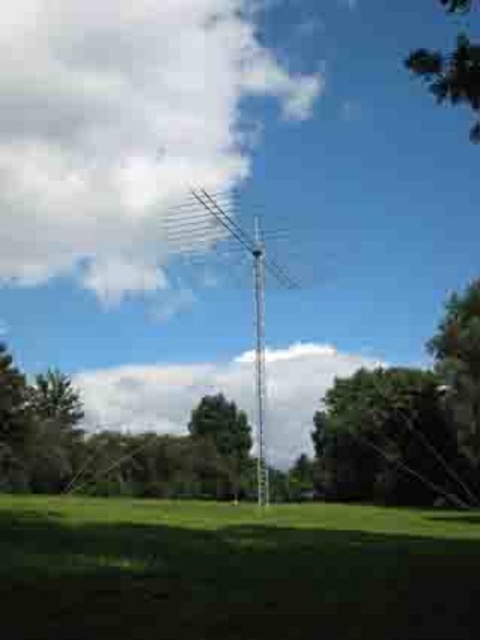
You are a gardener planning to mow the lawn. You see the green grassy at lower center and the silver metallic antenna at center. Which area should you avoid mowing to prevent damaging the antenna?

You should avoid mowing the green grassy at lower center because it is positioned on the left side of the silver metallic antenna at center, which is the area closest to the antenna and could potentially damage it if mowed too close.

You are an architect designing a new antenna structure. You want to ensure that the antenna doesn not block the view of the sky. Given the white fluffy cloud at upper center and the green leafy tree at upper right, which one would be more visible from the ground level?

Result: The white fluffy cloud at upper center would be more visible from ground level because its width is larger than the green leafy tree at upper right, making it stand out more in the sky.